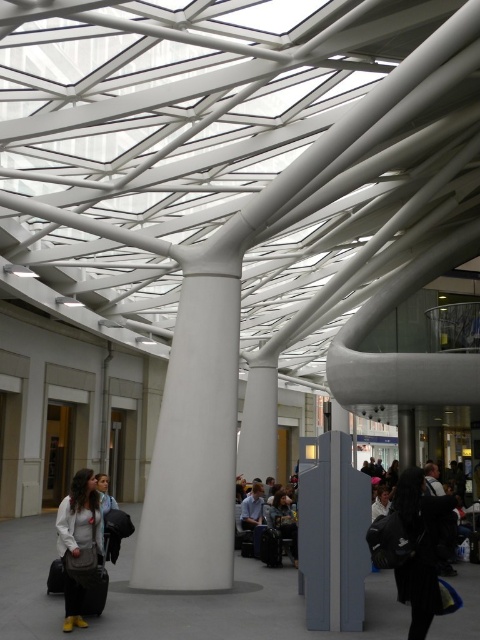
You are a traveler who just arrived at the station and see the black fuzzy coat at lower right and the matte white jacket at lower left. Which one is taller?

The matte white jacket at lower left is taller than the black fuzzy coat at lower right.

You are standing in the modern building and want to pick up both the matte white jacket at lower left and the dark brown leather jacket at center. Which jacket should you approach first to reach the one closer to you?

You should approach the matte white jacket at lower left first because it is closer to you than the dark brown leather jacket at center.

You are standing at the entrance of the building and notice a matte white jacket at lower left. If you want to reach it quickly, in which general direction should you move?

The matte white jacket at lower left is located at point 0.850 on the x and 0.165 on the y axis. Since you are at the entrance, which is likely at the lower right corner, you should move towards the lower left direction to reach it quickly.